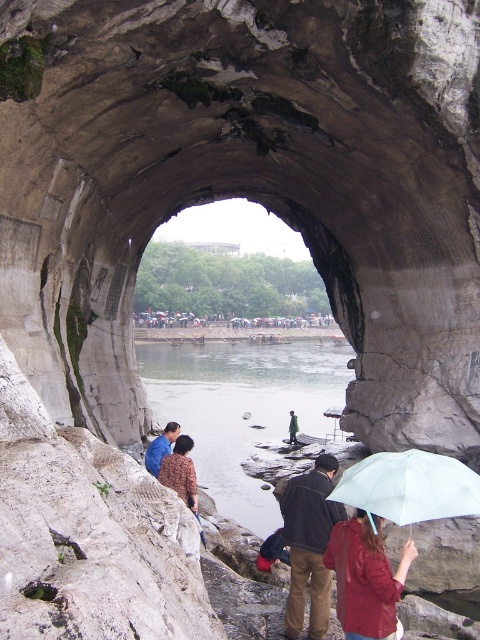
Does point (195, 486) come farther from viewer compared to point (168, 448)?

That is False.

Is point (166, 476) closer to camera compared to point (169, 433)?

Yes, point (166, 476) is in front of point (169, 433).

Find the location of a particular element. The height and width of the screenshot is (640, 480). brown textured sweater at center is located at coordinates (180, 472).

How much distance is there between light blue fabric umbrella at center and blue fabric shirt at center?

light blue fabric umbrella at center is 19.21 meters away from blue fabric shirt at center.

This screenshot has width=480, height=640. What are the coordinates of `light blue fabric umbrella at center` in the screenshot? It's located at (408, 486).

Which is more to the left, brown textured sweater at center or green fabric jacket at center?

From the viewer's perspective, brown textured sweater at center appears more on the left side.

Who is higher up, brown textured sweater at center or green fabric jacket at center?

Positioned higher is brown textured sweater at center.

Find the location of a particular element. brown textured sweater at center is located at coordinates (180, 472).